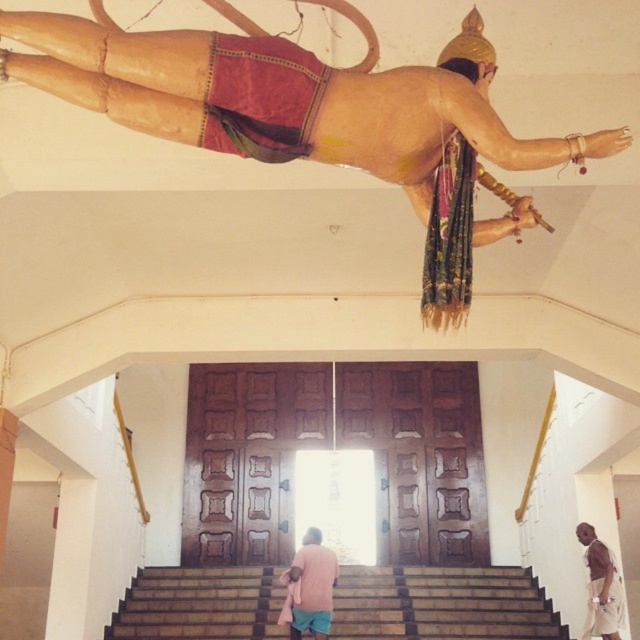
You are a visitor standing at the entrance of the temple. You see the brown wooden stairs at center and the pink fabric at lower center. Which object is taller?

The pink fabric at lower center is taller than the brown wooden stairs at center.

You are standing in the temple and want to exit through the doors behind the brown wooden stairs at center. Can you walk directly towards the doors without stepping on the brown cotton shirt at lower right?

The brown wooden stairs at center is further to the viewer than brown cotton shirt at lower right, so the stairs are closer to you. To exit through the doors behind the stairs, you would need to step onto the stairs first. The brown cotton shirt at lower right is behind you, so you can walk towards the doors without stepping on it.